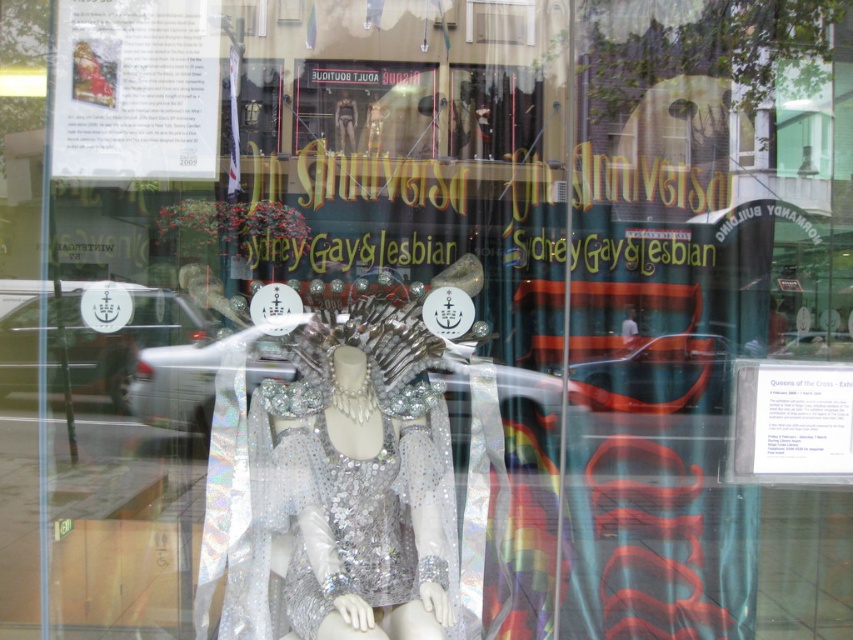
You are a window designer working on a display for the Sydney Gay and Lesbian Mardi Gras. You need to place a new accessory between the holographic sequined dress at center and the sparkly silver dress at center. The accessory requires at least 2 inches of space to fit. Based on the current setup, can you fit the accessory between them?

The distance between the holographic sequined dress at center and the sparkly silver dress at center is 1.95 inches. Since the accessory requires at least 2 inches of space, it cannot be placed between them as the available space is slightly less than required.